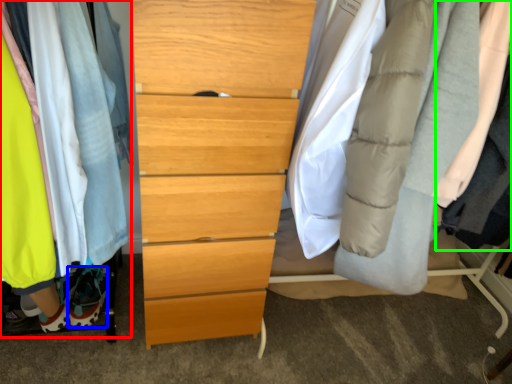
Question: Which object is the closest to the closet (highlighted by a red box)? Choose among these: shoe (highlighted by a blue box) or robe (highlighted by a green box).

Choices:
 (A) shoe
 (B) robe

Answer: (A)